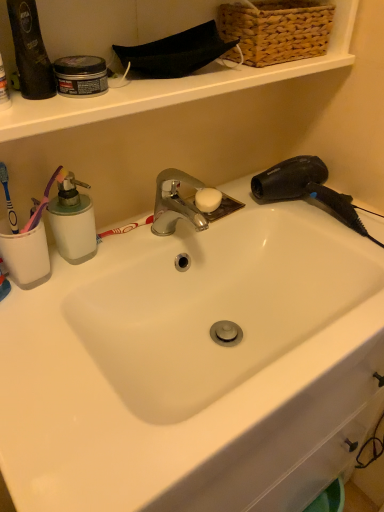
Locate an element on the screen. This screenshot has height=512, width=384. vacant region below black plastic hair dryer at upper right (from a real-world perspective) is located at coordinates (311, 215).